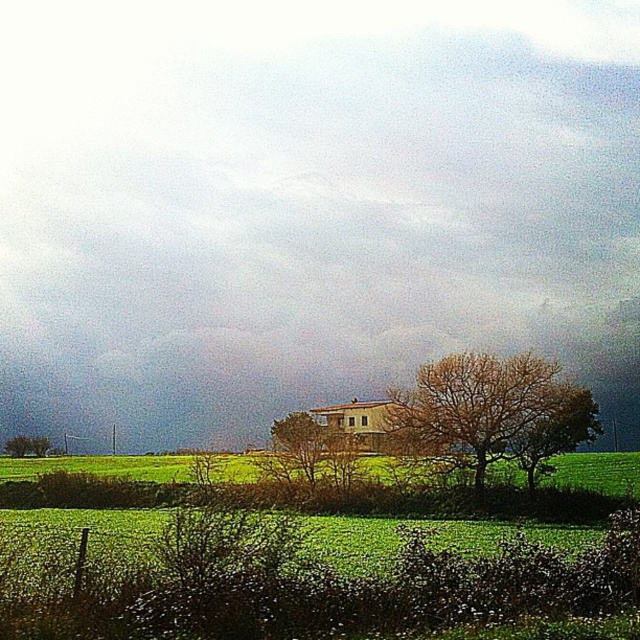
You are an artist planning to paint the rural landscape scene. You want to ensure the cloudy sky at center and the bare branches at center are proportionally accurate. Which object should you make wider in your painting?

The cloudy sky at center should be made wider in the painting since its width is larger than the bare branches at center according to the description.

You are standing in the rural landscape and want to take a photo of the bare branches at center. Based on their position, where should you aim your camera to capture them in the frame?

The bare branches at center are located at coordinates point (490, 413), so you should aim your camera towards the central area slightly towards the right and upper part of the frame to capture them.